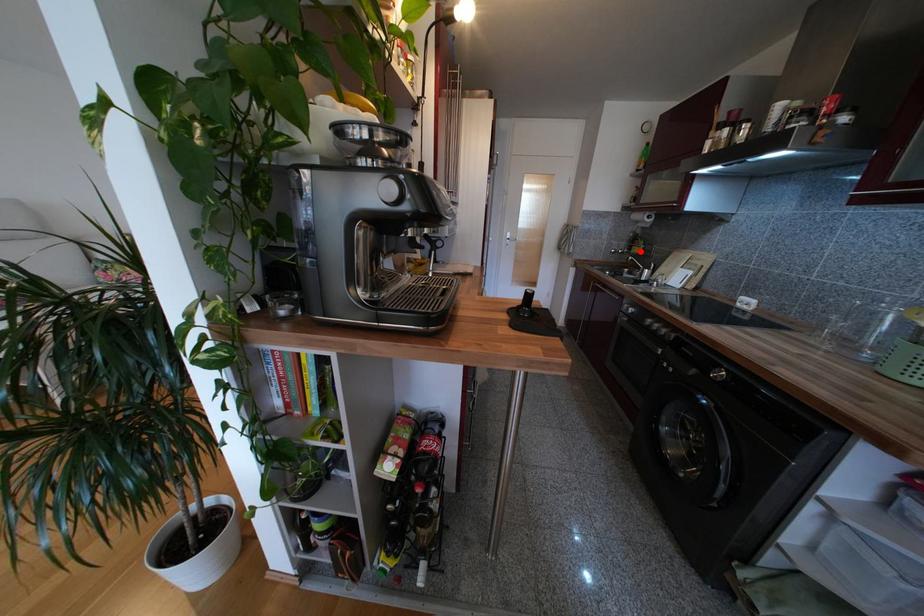
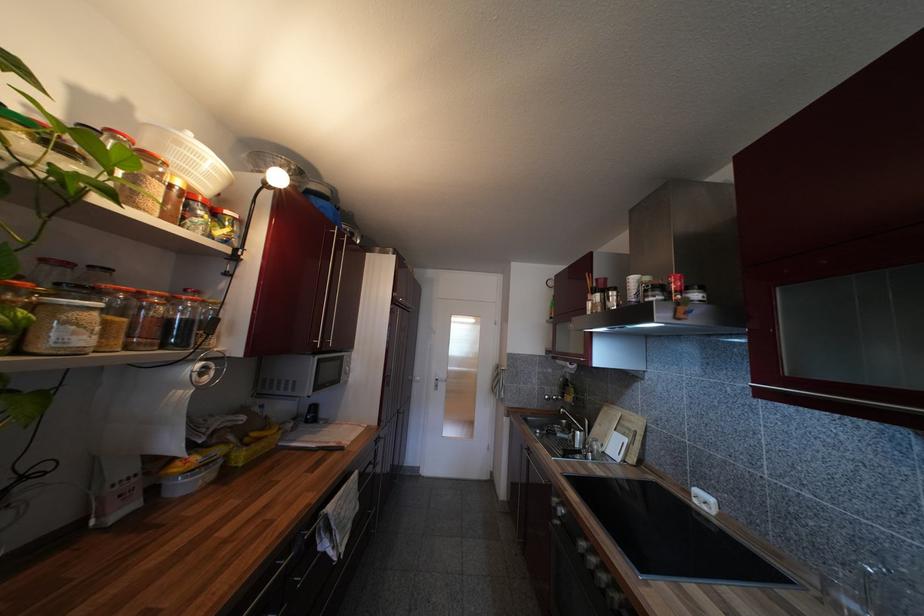
In the second image, find the point that corresponds to the highlighted location in the first image.

(573, 400)